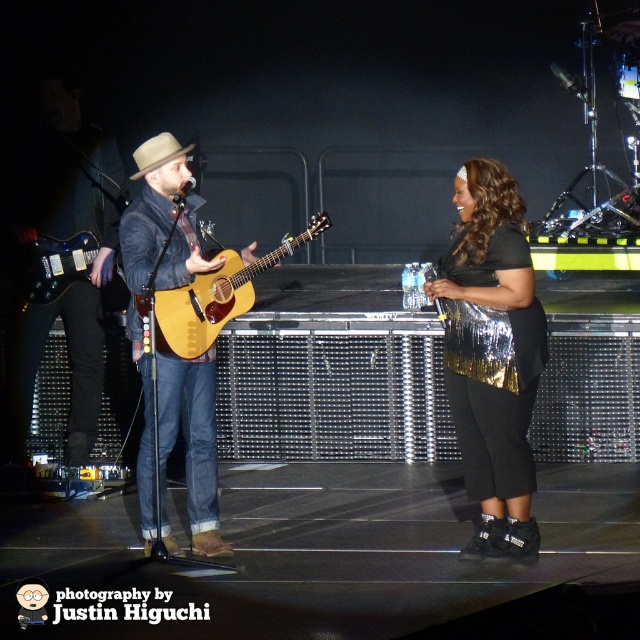
Question: Based on their relative distances, which object is nearer to the light brown acoustic guitar at center?

Choices:
 (A) glossy wood guitar at left
 (B) black sequined purse at center
 (C) beige felt cowboy hat at center
 (D) denim jacket at center

Answer: (D)

Question: Does light brown acoustic guitar at center have a lesser width compared to beige felt cowboy hat at center?

Choices:
 (A) yes
 (B) no

Answer: (B)

Question: Which point is farther to the camera?

Choices:
 (A) (132, 266)
 (B) (188, 314)
 (C) (516, 472)
 (D) (97, 241)

Answer: (D)

Question: Is black sequined purse at center below matte brown guitar at left?

Choices:
 (A) no
 (B) yes

Answer: (B)

Question: Which object appears closest to the camera in this image?

Choices:
 (A) glossy wood guitar at left
 (B) light brown acoustic guitar at center

Answer: (B)

Question: Can you confirm if light brown acoustic guitar at center is bigger than glossy wood guitar at left?

Choices:
 (A) no
 (B) yes

Answer: (B)